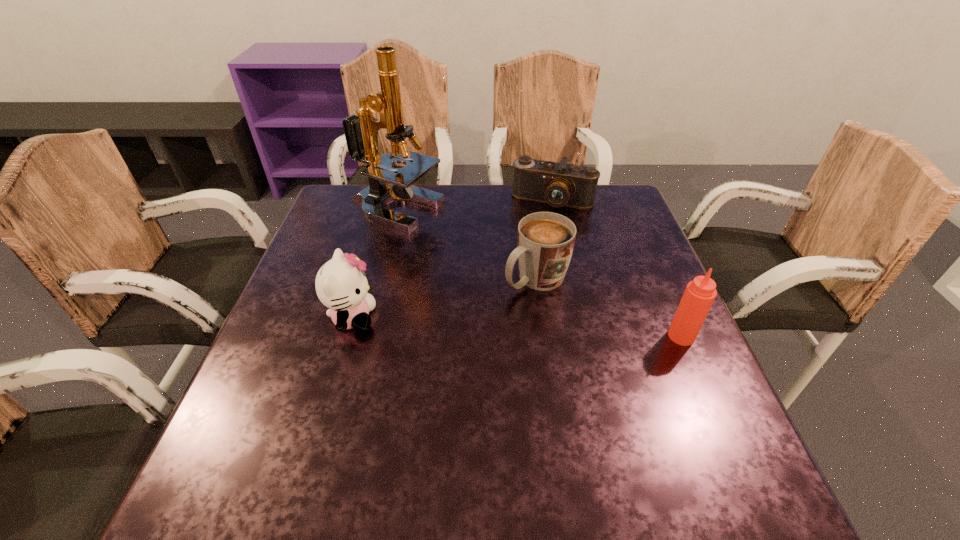
Where is `Tabasco sauce at the right edge`? The image size is (960, 540). Tabasco sauce at the right edge is located at coordinates (699, 295).

Find the location of `camera that is at the right edge`. camera that is at the right edge is located at coordinates (560, 184).

You are a GUI agent. You are given a task and a screenshot of the screen. Output one action in this format:
    pyautogui.click(x=<x>, y=<y>)
    Task: Click on the object that is at the far left corner
    This screenshot has width=960, height=540.
    Given the screenshot: What is the action you would take?
    pyautogui.click(x=361, y=132)

Locate an element on the screen. This screenshot has width=960, height=540. object that is at the far right corner is located at coordinates (560, 184).

Locate an element on the screen. vacant space at the far edge of the desktop is located at coordinates (467, 197).

Find the location of a particular element. This screenshot has width=960, height=540. vacant space at the left edge of the desktop is located at coordinates (314, 271).

I want to click on free space at the right edge of the desktop, so click(632, 262).

What are the coordinates of `free location at the near left corner` in the screenshot? It's located at (294, 434).

Find the location of `vacant space at the far right corner of the desktop`. vacant space at the far right corner of the desktop is located at coordinates click(610, 186).

I want to click on free region at the near right corner, so click(646, 429).